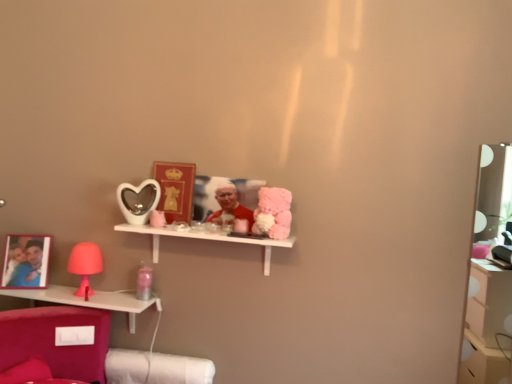
Question: Is matte white heart-shaped mirror at center positioned with its back to smooth red fabric at center?

Choices:
 (A) no
 (B) yes

Answer: (A)

Question: Is matte white heart-shaped mirror at center positioned beyond the bounds of smooth red fabric at center?

Choices:
 (A) no
 (B) yes

Answer: (B)

Question: Is matte white heart-shaped mirror at center facing towards smooth red fabric at center?

Choices:
 (A) no
 (B) yes

Answer: (A)

Question: From a real-world perspective, is matte white heart-shaped mirror at center physically below smooth red fabric at center?

Choices:
 (A) no
 (B) yes

Answer: (B)

Question: Is matte white heart-shaped mirror at center not close to smooth red fabric at center?

Choices:
 (A) no
 (B) yes

Answer: (A)

Question: From the image's perspective, is fluffy pink plush at center located above or below matte white heart-shaped mirror at center?

Choices:
 (A) below
 (B) above

Answer: (A)

Question: Is point (257, 213) positioned closer to the camera than point (136, 215)?

Choices:
 (A) closer
 (B) farther

Answer: (A)

Question: Is fluffy pink plush at center taller or shorter than matte white heart-shaped mirror at center?

Choices:
 (A) tall
 (B) short

Answer: (B)

Question: From a real-world perspective, is fluffy pink plush at center positioned above or below matte white heart-shaped mirror at center?

Choices:
 (A) above
 (B) below

Answer: (B)

Question: From the image's perspective, relative to matte white heart-shaped mirror at center, is matte gold picture frame at center above or below?

Choices:
 (A) below
 (B) above

Answer: (B)

Question: Visually, is matte gold picture frame at center positioned to the left or to the right of matte white heart-shaped mirror at center?

Choices:
 (A) right
 (B) left

Answer: (A)

Question: From a real-world perspective, is matte gold picture frame at center above or below matte white heart-shaped mirror at center?

Choices:
 (A) below
 (B) above

Answer: (B)

Question: Looking at their shapes, would you say matte gold picture frame at center is wider or thinner than matte white heart-shaped mirror at center?

Choices:
 (A) wide
 (B) thin

Answer: (B)

Question: In the image, is smooth red fabric at center on the left side or the right side of matte pink lamp at left?

Choices:
 (A) left
 (B) right

Answer: (B)

Question: Is smooth red fabric at center in front of or behind matte pink lamp at left in the image?

Choices:
 (A) behind
 (B) front

Answer: (B)